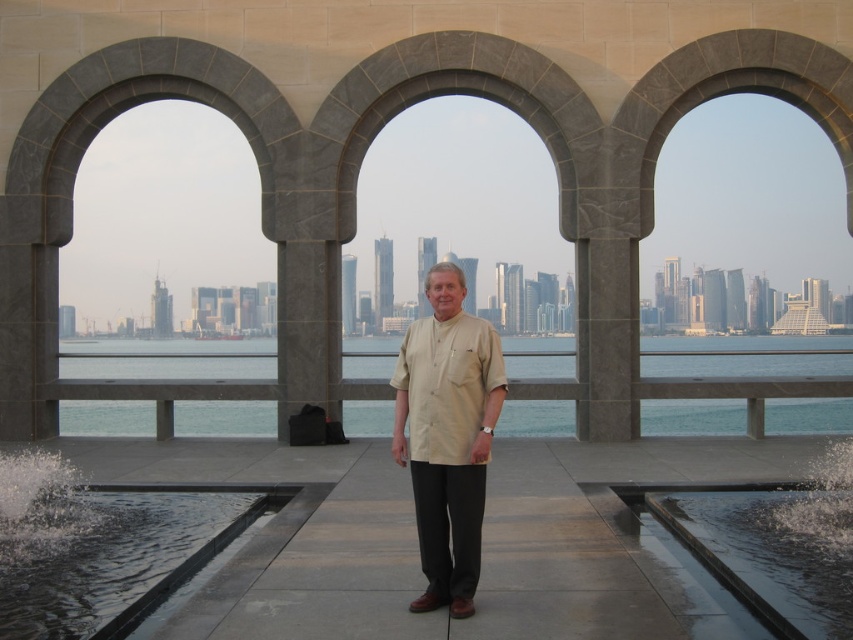
You are a photographer trying to capture the man standing under the arch. You have a camera that requires a minimum distance of 4 meters to focus properly. Can you position yourself at the black smooth water at lower left to take the photo without moving the man?

The distance between the black smooth water at lower left and the camera is 4.66 meters, which is more than the minimum required 4 meters. Therefore, you can position yourself at the black smooth water at lower left to take the photo without moving the man.

You are a photographer planning to capture a wide shot of the scene. You need to ensure that both the blue water at center and the black smooth water at lower left are clearly visible in your frame. Based on their positions, which water body will appear closer to the camera in the final photo?

The blue water at center appears closer to the camera because it is further to the viewer than the black smooth water at lower left, meaning it occupies a more foreground position in the image.

You are a photographer planning to capture the city skyline through the arches. You notice the blue water at center and the black smooth water at lower left. Which body of water would reflect the city skyline better, and why?

The blue water at center is located above black smooth water at lower left, so the black smooth water at lower left is lower and closer to the photographer. Since still water closer to the photographer can act as a mirror, the black smooth water at lower left would reflect the city skyline better because it is calmer and positioned lower, providing a clearer reflection.